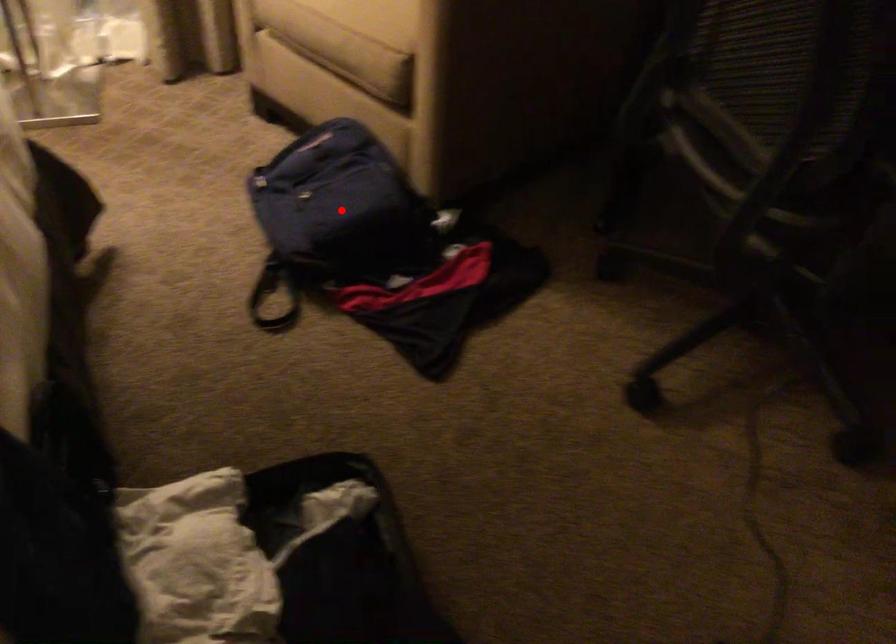
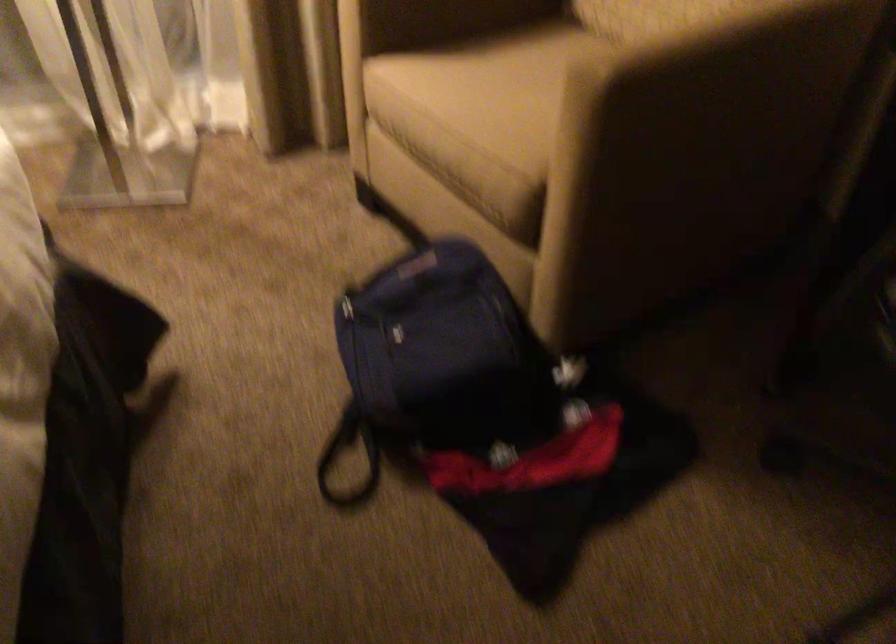
Question: I am providing you with two images of the same scene from different viewpoints. Image1 has a red point marked. In image2, the corresponding 3D location appears at what relative position? Reply with the corresponding letter.

Choices:
 (A) Closer
 (B) Farther

Answer: (A)